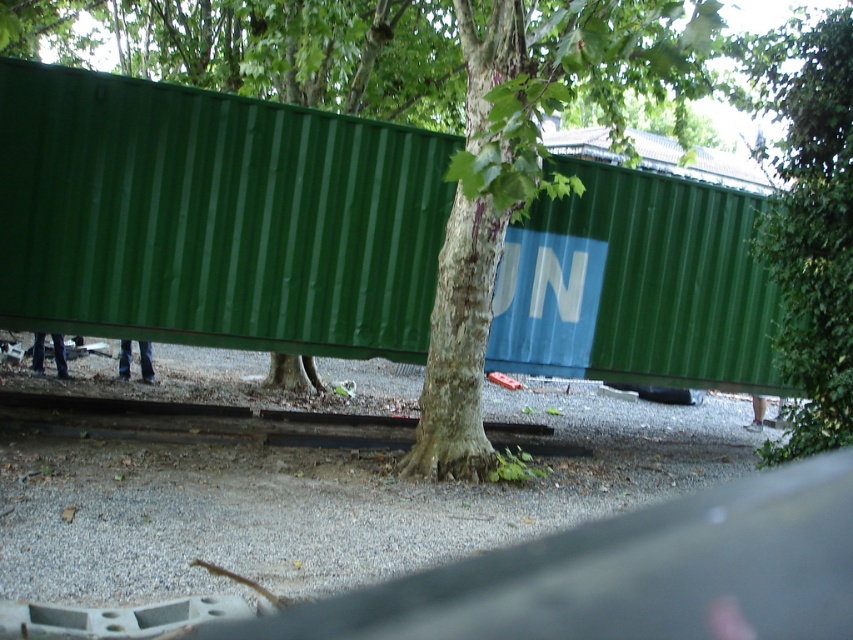
Which of these two, green corrugated metal shipping container at center or green corrugated metal at center, stands shorter?

green corrugated metal shipping container at center

Find the location of a particular element. green corrugated metal shipping container at center is located at coordinates (213, 218).

This screenshot has height=640, width=853. What are the coordinates of `green corrugated metal shipping container at center` in the screenshot? It's located at (213, 218).

Who is lower down, green corrugated metal at center or metallic gray train track at center?

metallic gray train track at center

Image resolution: width=853 pixels, height=640 pixels. Describe the element at coordinates (808, 220) in the screenshot. I see `green corrugated metal at center` at that location.

In order to click on green corrugated metal at center in this screenshot , I will do `click(808, 220)`.

Image resolution: width=853 pixels, height=640 pixels. What do you see at coordinates (213, 218) in the screenshot?
I see `green corrugated metal shipping container at center` at bounding box center [213, 218].

At what (x,y) coordinates should I click in order to perform the action: click on green corrugated metal shipping container at center. Please return your answer as a coordinate pair (x, y). The image size is (853, 640). Looking at the image, I should click on (213, 218).